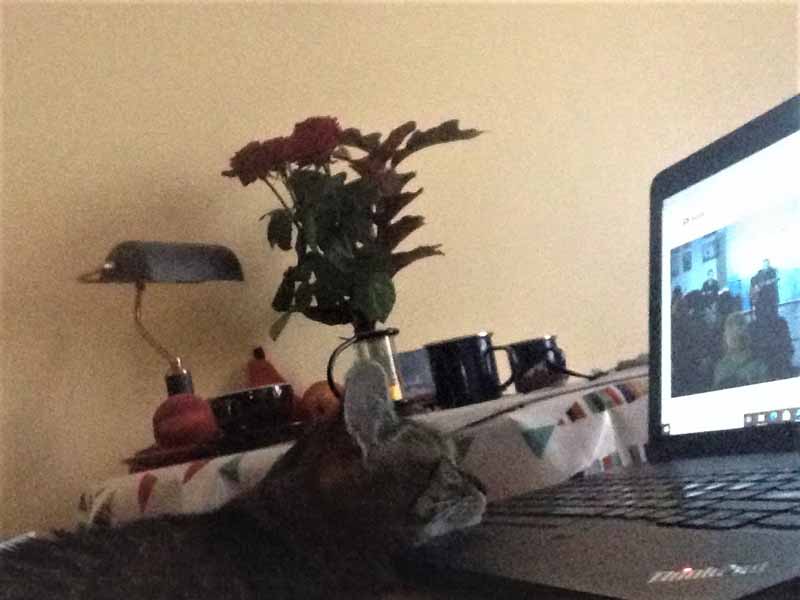
At what (x,y) coordinates should I click in order to perform the action: click on base of the lamp. Please return your answer as a coordinate pair (x, y). Image resolution: width=800 pixels, height=600 pixels. Looking at the image, I should click on (170, 378).